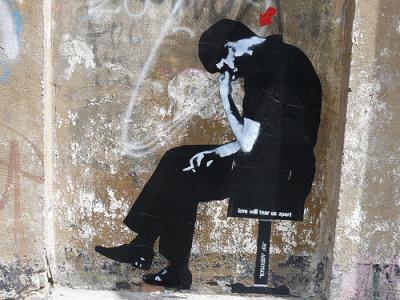
In order to click on stool in this screenshot , I will do pyautogui.click(x=266, y=208).